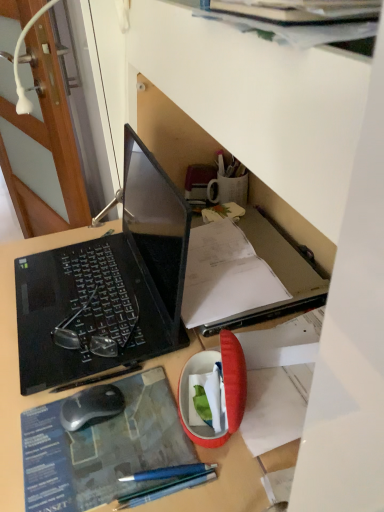
Identify the location of wooden door at left. (41, 142).

Image resolution: width=384 pixels, height=512 pixels. Identify the location of blue paper at center. (102, 448).

Measure the distance between point (26, 318) and camera.

Point (26, 318) is 32.17 inches from camera.

What are the coordinates of `black matte laptop at left` in the screenshot? It's located at (109, 284).

What do you see at coordinates (91, 406) in the screenshot?
I see `silver matte computer mouse at lower left` at bounding box center [91, 406].

Find the location of a particular element. Image resolution: width=384 pixels, height=512 pixels. wooden door at left is located at coordinates (41, 142).

Which is more to the right, blue paper at center or wooden door at left?

From the viewer's perspective, blue paper at center appears more on the right side.

Between blue paper at center and wooden door at left, which one has smaller size?

blue paper at center is smaller.

In the scene shown: Considering the sizes of blue paper at center and wooden door at left in the image, is blue paper at center wider or thinner than wooden door at left?

blue paper at center is wider than wooden door at left.

Between black matte laptop at left and blue paper at center, which one has smaller width?

Thinner between the two is blue paper at center.

Is point (176, 326) positioned behind point (41, 478)?

Yes, point (176, 326) is farther from viewer.

In the scene shown: Which object is positioned more to the left, black matte laptop at left or blue paper at center?

black matte laptop at left is more to the left.

Considering the sizes of objects black matte laptop at left and blue paper at center in the image provided, who is shorter, black matte laptop at left or blue paper at center?

Standing shorter between the two is blue paper at center.

Can we say black matte laptop at left lies outside silver matte computer mouse at lower left?

Yes.

How different are the orientations of black matte laptop at left and silver matte computer mouse at lower left in degrees?

5.42 degrees separate the facing orientations of black matte laptop at left and silver matte computer mouse at lower left.

Considering the sizes of objects black matte laptop at left and silver matte computer mouse at lower left in the image provided, who is taller, black matte laptop at left or silver matte computer mouse at lower left?

black matte laptop at left.

How much distance is there between silver matte computer mouse at lower left and black matte laptop at left?

They are 10.29 inches apart.

The image size is (384, 512). Find the location of `computer mouse below the black matte laptop at left (from a real-world perspective)`. computer mouse below the black matte laptop at left (from a real-world perspective) is located at coordinates (91, 406).

In the scene shown: Between silver matte computer mouse at lower left and black matte laptop at left, which one has more height?

black matte laptop at left.

Does silver matte computer mouse at lower left come in front of black matte laptop at left?

No, it is behind black matte laptop at left.

Which is further, (11, 141) or (118, 359)?

The point (11, 141) is farther from the camera.

Consider the image. How different are the orientations of wooden door at left and black matte laptop at left in degrees?

There is a 19.5-degree angle between the facing directions of wooden door at left and black matte laptop at left.

From a real-world perspective, who is located higher, wooden door at left or black matte laptop at left?

From a 3D spatial view, black matte laptop at left is above.

Between wooden door at left and black matte laptop at left, which one appears on the left side from the viewer's perspective?

wooden door at left is more to the left.

Considering the positions of objects blue paper at center and silver matte computer mouse at lower left in the image provided, who is behind, blue paper at center or silver matte computer mouse at lower left?

Positioned behind is silver matte computer mouse at lower left.

Would you consider blue paper at center to be distant from silver matte computer mouse at lower left?

No, blue paper at center is not far from silver matte computer mouse at lower left.

Does point (77, 508) come behind point (103, 410)?

No, (77, 508) is in front of (103, 410).

Is blue paper at center at the left side of silver matte computer mouse at lower left?

No.

Between point (2, 138) and point (88, 406), which one is positioned behind?

The point (2, 138) is behind.

Do you think wooden door at left is within silver matte computer mouse at lower left, or outside of it?

wooden door at left is located beyond the bounds of silver matte computer mouse at lower left.

Considering the sizes of wooden door at left and silver matte computer mouse at lower left in the image, is wooden door at left wider or thinner than silver matte computer mouse at lower left?

Clearly, wooden door at left has more width compared to silver matte computer mouse at lower left.

Is silver matte computer mouse at lower left at the back of wooden door at left?

No, wooden door at left's orientation is not away from silver matte computer mouse at lower left.

I want to click on paperback book that is on the right side of wooden door at left, so click(x=102, y=448).

Identify the location of paperback book located underneath the black matte laptop at left (from a real-world perspective). (102, 448).

Estimate the real-world distances between objects in this image. Which object is further from silver matte computer mouse at lower left, wooden door at left or blue paper at center?

Based on the image, wooden door at left appears to be further to silver matte computer mouse at lower left.

Considering their positions, is wooden door at left positioned closer to blue paper at center than black matte laptop at left?

Among the two, black matte laptop at left is located nearer to blue paper at center.

Estimate the real-world distances between objects in this image. Which object is further from black matte laptop at left, silver matte computer mouse at lower left or blue paper at center?

silver matte computer mouse at lower left is further to black matte laptop at left.

From the image, which object appears to be nearer to black matte laptop at left, blue paper at center or silver matte computer mouse at lower left?

blue paper at center is positioned closer to the anchor black matte laptop at left.

Considering their positions, is silver matte computer mouse at lower left positioned further to blue paper at center than wooden door at left?

wooden door at left.

Considering their positions, is silver matte computer mouse at lower left positioned further to wooden door at left than blue paper at center?

silver matte computer mouse at lower left is positioned further to the anchor wooden door at left.

Estimate the real-world distances between objects in this image. Which object is further from silver matte computer mouse at lower left, blue paper at center or wooden door at left?

wooden door at left is further to silver matte computer mouse at lower left.

When comparing their distances from blue paper at center, does black matte laptop at left or wooden door at left seem further?

wooden door at left is positioned further to the anchor blue paper at center.

Where is `laptop that lies between wooden door at left and blue paper at center from top to bottom`? laptop that lies between wooden door at left and blue paper at center from top to bottom is located at coordinates (109, 284).

You are a GUI agent. You are given a task and a screenshot of the screen. Output one action in this format:
    pyautogui.click(x=<x>, y=<y>)
    Task: Click on the computer mouse between black matte laptop at left and blue paper at center vertically
    The width and height of the screenshot is (384, 512).
    Given the screenshot: What is the action you would take?
    pyautogui.click(x=91, y=406)

Identify the location of computer mouse between wooden door at left and blue paper at center from top to bottom. This screenshot has height=512, width=384. (91, 406).

The image size is (384, 512). Identify the location of laptop between wooden door at left and silver matte computer mouse at lower left in the up-down direction. (109, 284).